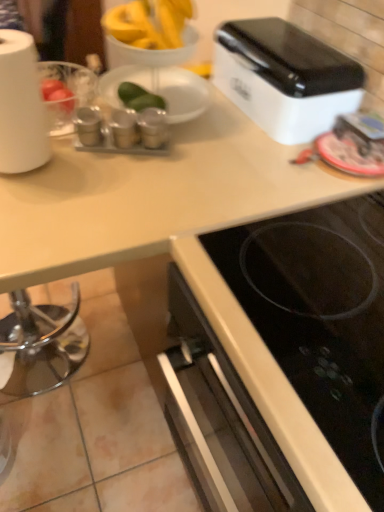
At what (x,y) coordinates should I click in order to perform the action: click on white glossy toaster at upper right. Please return your answer as a coordinate pair (x, y). This screenshot has width=384, height=512. Looking at the image, I should click on (285, 78).

The height and width of the screenshot is (512, 384). I want to click on metallic silver canisters at upper left, the 1th appliance viewed from the left, so coord(88,126).

Identify the location of black glass cooktop at lower right. (319, 316).

What is the approximate width of metallic silver spice containers at center, acting as the second appliance starting from the left?

8.23 centimeters.

You are a GUI agent. You are given a task and a screenshot of the screen. Output one action in this format:
    pyautogui.click(x=<x>, y=<y>)
    Task: Click on the white glossy toaster at upper right
    This screenshot has width=384, height=512.
    Given the screenshot: What is the action you would take?
    pyautogui.click(x=285, y=78)

From the image's perspective, who appears lower, black glass cooktop at lower right or white glossy toaster at upper right?

black glass cooktop at lower right appears lower in the image.

Can you confirm if black glass cooktop at lower right is taller than white glossy toaster at upper right?

Yes, black glass cooktop at lower right is taller than white glossy toaster at upper right.

Locate an element on the screen. Image resolution: width=384 pixels, height=512 pixels. toaster that appears behind the black glass cooktop at lower right is located at coordinates (285, 78).

Is point (83, 109) farther from viewer compared to point (305, 131)?

No, it is in front of (305, 131).

Can you confirm if metallic silver canisters at upper left, which is the 3th appliance in right-to-left order, is thinner than white glossy toaster at upper right?

Correct, the width of metallic silver canisters at upper left, which is the 3th appliance in right-to-left order, is less than that of white glossy toaster at upper right.

Considering the relative sizes of metallic silver canisters at upper left, which is the 3th appliance in right-to-left order, and white glossy toaster at upper right in the image provided, is metallic silver canisters at upper left, which is the 3th appliance in right-to-left order, shorter than white glossy toaster at upper right?

Yes.

Can you tell me how much metallic silver canisters at upper left, the 1th appliance viewed from the left, and white glossy toaster at upper right differ in facing direction?

They differ by 65.2 degrees in their facing directions.

Can you confirm if metallic silver canisters at upper left, which is the 3th appliance in right-to-left order, is smaller than black glass cooktop at lower right?

Correct, metallic silver canisters at upper left, which is the 3th appliance in right-to-left order, occupies less space than black glass cooktop at lower right.

Which is more to the right, metallic silver canisters at upper left, which is the 3th appliance in right-to-left order, or black glass cooktop at lower right?

Positioned to the right is black glass cooktop at lower right.

From a real-world perspective, is metallic silver canisters at upper left, the 1th appliance viewed from the left, positioned under black glass cooktop at lower right based on gravity?

Answer: No, from a real-world perspective, metallic silver canisters at upper left, the 1th appliance viewed from the left, is not below black glass cooktop at lower right.

Is metallic silver canisters at upper left, the 1th appliance viewed from the left, further to the viewer compared to black glass cooktop at lower right?

Yes, it is behind black glass cooktop at lower right.

Is point (328, 234) positioned before point (10, 114)?

Yes, point (328, 234) is closer to viewer.

Image resolution: width=384 pixels, height=512 pixels. In the image, there is a black glass cooktop at lower right. In order to click on paper towel above it (from the image's perspective) in this screenshot , I will do `click(20, 106)`.

Between black glass cooktop at lower right and white matte paper towel at left, which one has more height?

white matte paper towel at left.

Which object is positioned more to the left, black glass cooktop at lower right or white matte paper towel at left?

From the viewer's perspective, white matte paper towel at left appears more on the left side.

Considering the points (132, 138) and (84, 111), which point is in front, point (132, 138) or point (84, 111)?

The point (132, 138) is closer.

Looking at this image, considering the relative positions of metallic silver spice containers at center, which appears as the 2th appliance when viewed from the right, and metallic silver canisters at upper left, the 1th appliance viewed from the left, in the image provided, is metallic silver spice containers at center, which appears as the 2th appliance when viewed from the right, in front of metallic silver canisters at upper left, the 1th appliance viewed from the left,?

No.

From the image's perspective, is metallic silver spice containers at center, which appears as the 2th appliance when viewed from the right, positioned above or below metallic silver canisters at upper left, the 1th appliance viewed from the left?

metallic silver spice containers at center, which appears as the 2th appliance when viewed from the right, is below metallic silver canisters at upper left, the 1th appliance viewed from the left.

From a real-world perspective, is metallic silver spice containers at center, which appears as the 2th appliance when viewed from the right, positioned above or below metallic silver canisters at upper left, which is the 3th appliance in right-to-left order?

metallic silver spice containers at center, which appears as the 2th appliance when viewed from the right, is situated lower than metallic silver canisters at upper left, which is the 3th appliance in right-to-left order, in the real world.

Does metallic silver spice containers at center, which appears as the 2th appliance when viewed from the right, turn towards black glass cooktop at lower right?

No, metallic silver spice containers at center, which appears as the 2th appliance when viewed from the right, is not oriented towards black glass cooktop at lower right.

How distant is metallic silver spice containers at center, acting as the second appliance starting from the left, from black glass cooktop at lower right?

metallic silver spice containers at center, acting as the second appliance starting from the left, and black glass cooktop at lower right are 21.03 inches apart.

Which of these two, metallic silver spice containers at center, acting as the second appliance starting from the left, or black glass cooktop at lower right, is bigger?

With larger size is black glass cooktop at lower right.

From a real-world perspective, which object stands above the other?

metallic silver spice containers at center, acting as the second appliance starting from the left, from a real-world perspective.

Locate an element on the screen. toaster that is on the right side of metallic silver spice containers at center, which appears as the 2th appliance when viewed from the right is located at coordinates (285, 78).

Would you say metallic silver spice containers at center, acting as the second appliance starting from the left, is inside or outside white glossy toaster at upper right?

metallic silver spice containers at center, acting as the second appliance starting from the left, cannot be found inside white glossy toaster at upper right.

In terms of width, does metallic silver spice containers at center, acting as the second appliance starting from the left, look wider or thinner when compared to white glossy toaster at upper right?

In the image, metallic silver spice containers at center, acting as the second appliance starting from the left, appears to be more narrow than white glossy toaster at upper right.

From a real-world perspective, is metallic silver spice containers at center, acting as the second appliance starting from the left, positioned above or below white glossy toaster at upper right?

metallic silver spice containers at center, acting as the second appliance starting from the left, is below white glossy toaster at upper right.

Locate an element on the screen. toaster on the left of the black glass cooktop at lower right is located at coordinates (285, 78).

Identify the location of the 2nd appliance directly beneath the white glossy toaster at upper right (from a real-world perspective). (88, 126).

In the scene shown: From the image, which object appears to be farther from metallic silver spice containers at center, which ranks as the third appliance in left-to-right order, white matte paper towel at left or metallic silver canisters at upper left, which is the 3th appliance in right-to-left order?

white matte paper towel at left.

Looking at the image, which one is located further to metallic silver spice containers at center, which ranks as the third appliance in left-to-right order, metallic silver spice containers at center, which appears as the 2th appliance when viewed from the right, or white glossy toaster at upper right?

A: white glossy toaster at upper right is positioned further to the anchor metallic silver spice containers at center, which ranks as the third appliance in left-to-right order.

Estimate the real-world distances between objects in this image. Which object is closer to white glossy toaster at upper right, metallic silver spice containers at center, acting as the second appliance starting from the left, or black glass cooktop at lower right?

metallic silver spice containers at center, acting as the second appliance starting from the left, is closer to white glossy toaster at upper right.

Which object lies further to the anchor point white matte paper towel at left, metallic silver canisters at upper left, which is the 3th appliance in right-to-left order, or white glossy toaster at upper right?

white glossy toaster at upper right is positioned further to the anchor white matte paper towel at left.

In the scene shown: Looking at the image, which one is located further to white matte paper towel at left, white glossy toaster at upper right or black glass cooktop at lower right?

Based on the image, white glossy toaster at upper right appears to be further to white matte paper towel at left.

Consider the image. When comparing their distances from metallic silver spice containers at center, which appears as the 2th appliance when viewed from the right, does white glossy toaster at upper right or metallic silver spice containers at center, which ranks as the third appliance in left-to-right order, seem further?

The object further to metallic silver spice containers at center, which appears as the 2th appliance when viewed from the right, is white glossy toaster at upper right.

Based on their spatial positions, is metallic silver spice containers at center, which ranks as the third appliance in left-to-right order, or black glass cooktop at lower right further from metallic silver spice containers at center, which appears as the 2th appliance when viewed from the right?

black glass cooktop at lower right.

From the image, which object appears to be nearer to white matte paper towel at left, black glass cooktop at lower right or white glossy toaster at upper right?

Answer: black glass cooktop at lower right is positioned closer to the anchor white matte paper towel at left.

Find the location of a particular element. This screenshot has height=512, width=384. appliance between metallic silver canisters at upper left, which is the 3th appliance in right-to-left order, and metallic silver spice containers at center, which ranks as the third appliance in left-to-right order, in the horizontal direction is located at coordinates (123, 128).

Image resolution: width=384 pixels, height=512 pixels. Find the location of `appliance between metallic silver spice containers at center, which appears as the 2th appliance when viewed from the right, and white glossy toaster at upper right, in the horizontal direction`. appliance between metallic silver spice containers at center, which appears as the 2th appliance when viewed from the right, and white glossy toaster at upper right, in the horizontal direction is located at coordinates (153, 127).

At what (x,y) coordinates should I click in order to perform the action: click on appliance positioned between black glass cooktop at lower right and metallic silver canisters at upper left, the 1th appliance viewed from the left, from near to far. Please return your answer as a coordinate pair (x, y). This screenshot has height=512, width=384. Looking at the image, I should click on coord(153,127).

Where is `appliance located between white matte paper towel at left and metallic silver canisters at upper left, the 1th appliance viewed from the left, in the depth direction`? Image resolution: width=384 pixels, height=512 pixels. appliance located between white matte paper towel at left and metallic silver canisters at upper left, the 1th appliance viewed from the left, in the depth direction is located at coordinates (153, 127).